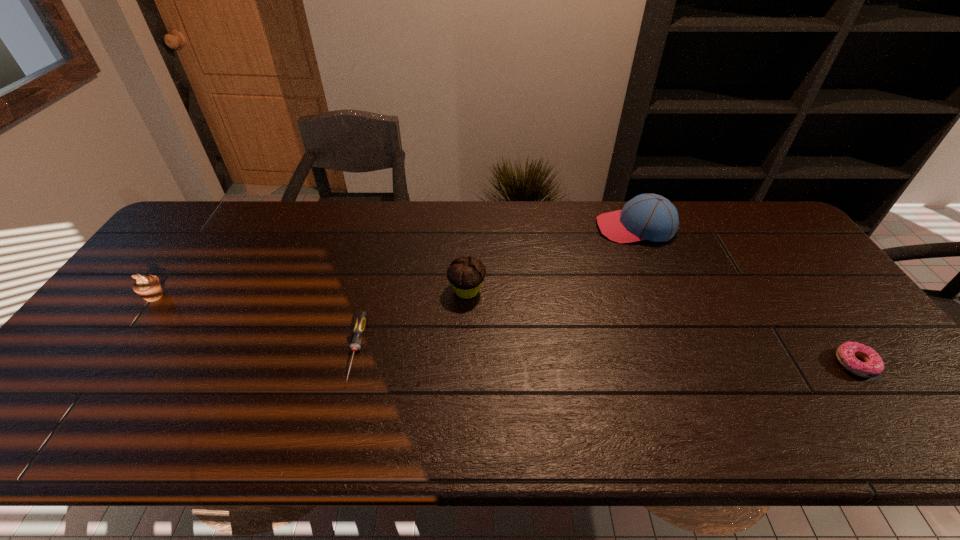
Find the location of a particular element. This screenshot has width=960, height=540. baseball cap is located at coordinates (652, 217).

In order to click on the second object from right to left in this screenshot , I will do `click(652, 217)`.

Locate an element on the screen. The width and height of the screenshot is (960, 540). the third object from right to left is located at coordinates pyautogui.click(x=466, y=275).

At what (x,y) coordinates should I click in order to perform the action: click on the shorter muffin. Please return your answer as a coordinate pair (x, y). Image resolution: width=960 pixels, height=540 pixels. Looking at the image, I should click on (149, 287).

The height and width of the screenshot is (540, 960). Identify the location of the third shortest object. (149, 287).

Locate an element on the screen. The image size is (960, 540). the fourth tallest object is located at coordinates (873, 365).

Image resolution: width=960 pixels, height=540 pixels. In order to click on the rightmost object in this screenshot , I will do `click(873, 365)`.

The width and height of the screenshot is (960, 540). Find the location of `the fourth object from right to left`. the fourth object from right to left is located at coordinates (361, 321).

Where is `the shortest object`? This screenshot has width=960, height=540. the shortest object is located at coordinates tap(361, 321).

Locate an element on the screen. This screenshot has height=540, width=960. blank space located 0.190m on the front-facing side of the baseball cap is located at coordinates (540, 228).